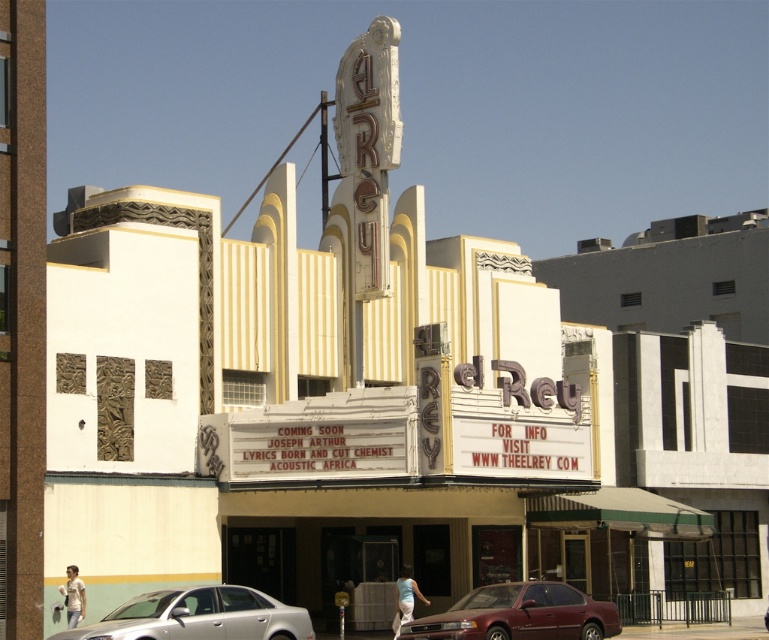
Does silver metallic sedan at lower center appear on the left side of light beige t-shirt at lower left?

In fact, silver metallic sedan at lower center is to the right of light beige t-shirt at lower left.

In the scene shown: Is silver metallic sedan at lower center positioned at the back of light beige t-shirt at lower left?

That is False.

Locate an element on the screen. The image size is (769, 640). silver metallic sedan at lower center is located at coordinates (198, 616).

Does silver metallic sedan at lower center have a smaller size compared to maroon metallic sedan at lower center?

Yes, silver metallic sedan at lower center is smaller than maroon metallic sedan at lower center.

Can you confirm if silver metallic sedan at lower center is positioned above maroon metallic sedan at lower center?

Indeed, silver metallic sedan at lower center is positioned over maroon metallic sedan at lower center.

The image size is (769, 640). What do you see at coordinates (198, 616) in the screenshot?
I see `silver metallic sedan at lower center` at bounding box center [198, 616].

Locate an element on the screen. The height and width of the screenshot is (640, 769). silver metallic sedan at lower center is located at coordinates (198, 616).

Describe the element at coordinates (198, 616) in the screenshot. The height and width of the screenshot is (640, 769). I see `silver metallic sedan at lower center` at that location.

Locate an element on the screen. The height and width of the screenshot is (640, 769). silver metallic sedan at lower center is located at coordinates (198, 616).